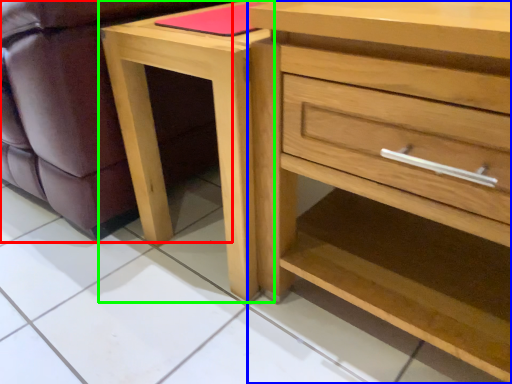
Question: Based on their relative distances, which object is nearer to swivel chair (highlighted by a red box)? Choose from chest of drawers (highlighted by a blue box) and nightstand (highlighted by a green box).

Choices:
 (A) chest of drawers
 (B) nightstand

Answer: (B)